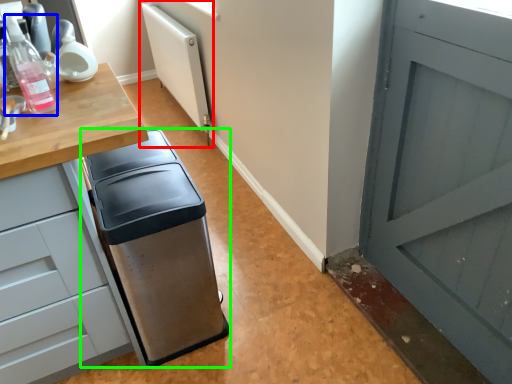
Question: Estimate the real-world distances between objects in this image. Which object is closer to radiator (highlighted by a red box), bottle (highlighted by a blue box) or waste container (highlighted by a green box)?

Choices:
 (A) bottle
 (B) waste container

Answer: (B)